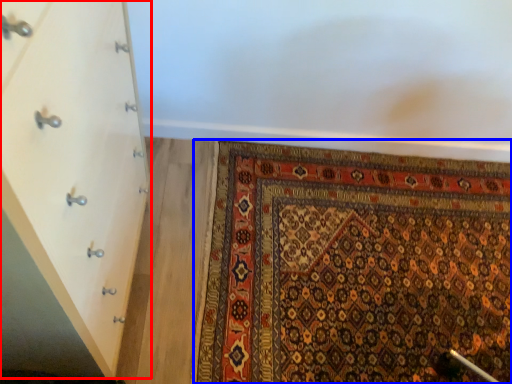
Question: Which of the following is the closest to the observer, chest of drawers (highlighted by a red box) or mat (highlighted by a blue box)?

Choices:
 (A) chest of drawers
 (B) mat

Answer: (A)